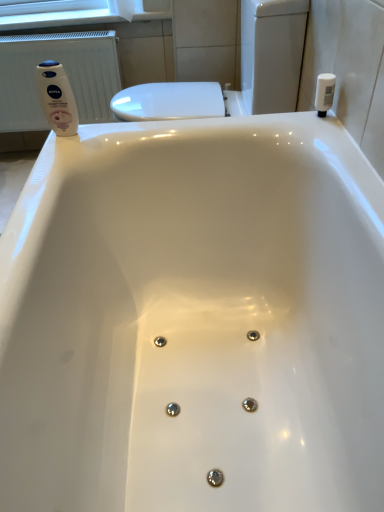
Question: Can you confirm if white matte lotion at upper left, the second toiletry when ordered from right to left, is taller than white plastic bottle at upper right, which appears as the 2th toiletry when viewed from the left?

Choices:
 (A) yes
 (B) no

Answer: (A)

Question: Would you consider white matte lotion at upper left, the second toiletry when ordered from right to left, to be distant from white plastic bottle at upper right, marked as the first toiletry in a right-to-left arrangement?

Choices:
 (A) no
 (B) yes

Answer: (A)

Question: From the image's perspective, is white matte lotion at upper left, which ranks as the 1th toiletry in left-to-right order, on white plastic bottle at upper right, which appears as the 2th toiletry when viewed from the left?

Choices:
 (A) yes
 (B) no

Answer: (B)

Question: Is white matte lotion at upper left, which ranks as the 1th toiletry in left-to-right order, turned away from white plastic bottle at upper right, which appears as the 2th toiletry when viewed from the left?

Choices:
 (A) yes
 (B) no

Answer: (A)

Question: Does white matte lotion at upper left, which ranks as the 1th toiletry in left-to-right order, have a lesser width compared to white plastic bottle at upper right, which appears as the 2th toiletry when viewed from the left?

Choices:
 (A) no
 (B) yes

Answer: (A)

Question: From the image's perspective, is white matte lotion at upper left, the second toiletry when ordered from right to left, located above or below white matte toilet paper at upper left?

Choices:
 (A) below
 (B) above

Answer: (A)

Question: Relative to white matte toilet paper at upper left, is white matte lotion at upper left, the second toiletry when ordered from right to left, in front or behind?

Choices:
 (A) behind
 (B) front

Answer: (B)

Question: Is white matte lotion at upper left, which ranks as the 1th toiletry in left-to-right order, wider or thinner than white matte toilet paper at upper left?

Choices:
 (A) wide
 (B) thin

Answer: (B)

Question: Do you think white matte lotion at upper left, which ranks as the 1th toiletry in left-to-right order, is within white matte toilet paper at upper left, or outside of it?

Choices:
 (A) outside
 (B) inside

Answer: (A)

Question: Is white plastic bottle at upper right, which appears as the 2th toiletry when viewed from the left, in front of or behind white matte toilet paper at upper left in the image?

Choices:
 (A) front
 (B) behind

Answer: (A)

Question: In terms of height, does white plastic bottle at upper right, which appears as the 2th toiletry when viewed from the left, look taller or shorter compared to white matte toilet paper at upper left?

Choices:
 (A) tall
 (B) short

Answer: (B)

Question: Does point (329, 80) appear closer or farther from the camera than point (140, 6)?

Choices:
 (A) closer
 (B) farther

Answer: (A)

Question: Considering the positions of white plastic bottle at upper right, which appears as the 2th toiletry when viewed from the left, and white matte toilet paper at upper left in the image, is white plastic bottle at upper right, which appears as the 2th toiletry when viewed from the left, wider or thinner than white matte toilet paper at upper left?

Choices:
 (A) thin
 (B) wide

Answer: (A)

Question: Considering their positions, is white matte toilet paper at upper left located in front of or behind white plastic radiator at left?

Choices:
 (A) front
 (B) behind

Answer: (A)

Question: From the image's perspective, relative to white plastic radiator at left, is white matte toilet paper at upper left above or below?

Choices:
 (A) below
 (B) above

Answer: (B)